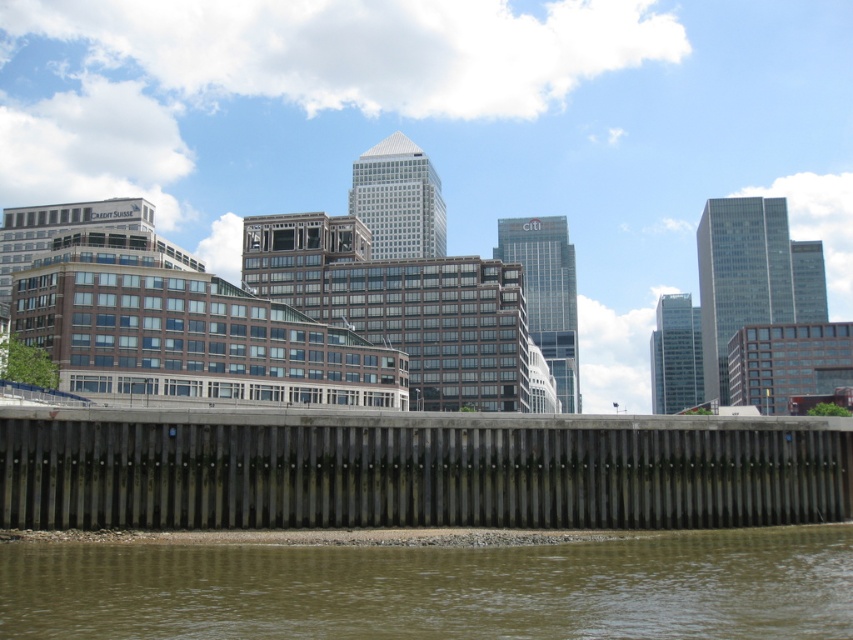
Question: Can you confirm if dark gray concrete dam at lower center is smaller than brown gravel at lower center?

Choices:
 (A) yes
 (B) no

Answer: (B)

Question: Can you confirm if dark gray concrete dam at lower center is wider than brown gravel at lower center?

Choices:
 (A) no
 (B) yes

Answer: (B)

Question: Is dark gray concrete dam at lower center wider than brown gravel at lower center?

Choices:
 (A) yes
 (B) no

Answer: (A)

Question: Which object appears closest to the camera in this image?

Choices:
 (A) brown gravel at lower center
 (B) dark gray concrete dam at lower center

Answer: (A)